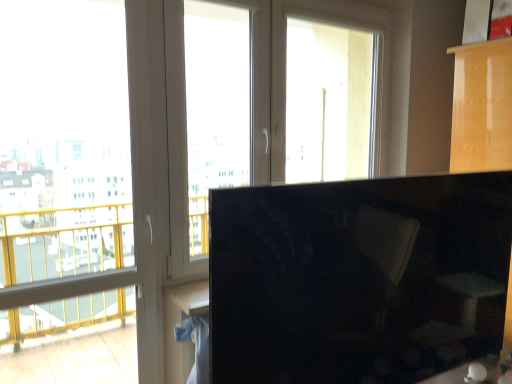
Question: Does transparent glass window at left, which ranks as the first window screen in left-to-right order, turn towards transparent glass window at center, acting as the second window screen starting from the left?

Choices:
 (A) no
 (B) yes

Answer: (A)

Question: From the image's perspective, does transparent glass window at left, the third window screen viewed from the right, appear higher than transparent glass window at center, the second window screen when ordered from right to left?

Choices:
 (A) yes
 (B) no

Answer: (B)

Question: Can you confirm if transparent glass window at left, which ranks as the first window screen in left-to-right order, is positioned to the right of transparent glass window at center, acting as the second window screen starting from the left?

Choices:
 (A) yes
 (B) no

Answer: (B)

Question: Is transparent glass window at left, the third window screen viewed from the right, completely or partially outside of transparent glass window at center, the second window screen when ordered from right to left?

Choices:
 (A) no
 (B) yes

Answer: (B)

Question: Would you consider transparent glass window at left, the third window screen viewed from the right, to be distant from transparent glass window at center, acting as the second window screen starting from the left?

Choices:
 (A) no
 (B) yes

Answer: (A)

Question: Is transparent glass window at left, which ranks as the first window screen in left-to-right order, in front of or behind transparent glass window at upper center, the first window screen in the right-to-left sequence, in the image?

Choices:
 (A) front
 (B) behind

Answer: (A)

Question: Looking at their shapes, would you say transparent glass window at left, the third window screen viewed from the right, is wider or thinner than transparent glass window at upper center, the third window screen positioned from the left?

Choices:
 (A) wide
 (B) thin

Answer: (B)

Question: Does point [0, 155] appear closer or farther from the camera than point [288, 145]?

Choices:
 (A) farther
 (B) closer

Answer: (B)

Question: From their relative heights in the image, would you say transparent glass window at left, the third window screen viewed from the right, is taller or shorter than transparent glass window at upper center, the first window screen in the right-to-left sequence?

Choices:
 (A) tall
 (B) short

Answer: (A)

Question: From the image's perspective, relative to transparent glass window at upper center, the third window screen positioned from the left, is transparent glass window at center, the second window screen when ordered from right to left, above or below?

Choices:
 (A) above
 (B) below

Answer: (B)

Question: Looking at the image, does transparent glass window at center, the second window screen when ordered from right to left, seem bigger or smaller compared to transparent glass window at upper center, the third window screen positioned from the left?

Choices:
 (A) big
 (B) small

Answer: (B)

Question: Which is correct: transparent glass window at center, the second window screen when ordered from right to left, is inside transparent glass window at upper center, the third window screen positioned from the left, or outside of it?

Choices:
 (A) outside
 (B) inside

Answer: (A)

Question: Considering the positions of point (248, 162) and point (375, 56), is point (248, 162) closer or farther from the camera than point (375, 56)?

Choices:
 (A) farther
 (B) closer

Answer: (B)

Question: Is transparent glass window at center, the second window screen when ordered from right to left, inside the boundaries of black glossy monitor at right, or outside?

Choices:
 (A) outside
 (B) inside

Answer: (A)

Question: Is transparent glass window at center, the second window screen when ordered from right to left, wider or thinner than black glossy monitor at right?

Choices:
 (A) thin
 (B) wide

Answer: (A)